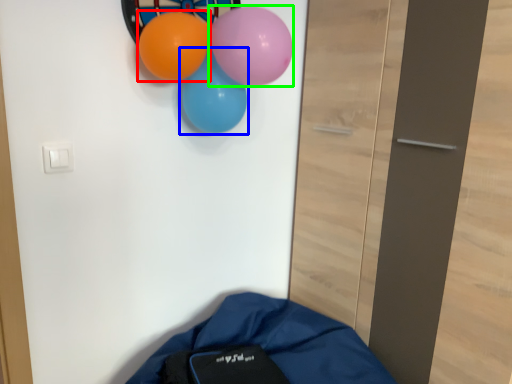
Question: Based on their relative distances, which object is nearer to balloon (highlighted by a red box)? Choose from balloon (highlighted by a blue box) and balloon (highlighted by a green box).

Choices:
 (A) balloon
 (B) balloon

Answer: (A)